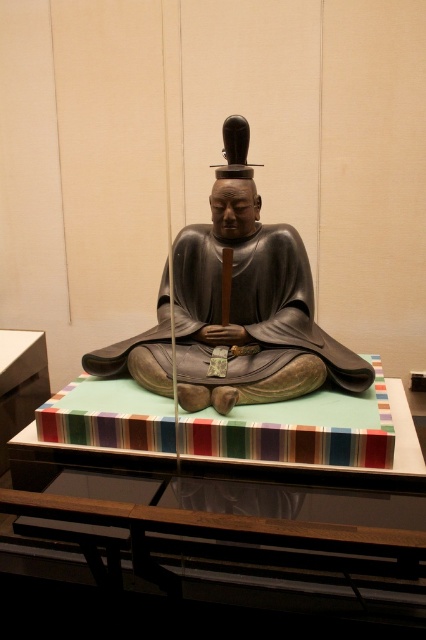
Question: Observing the image, what is the correct spatial positioning of green felt table at center in reference to matte gray statue at center?

Choices:
 (A) left
 (B) right

Answer: (B)

Question: Which object appears closest to the camera in this image?

Choices:
 (A) green felt table at center
 (B) matte gray statue at center

Answer: (A)

Question: Is green felt table at center above matte gray statue at center?

Choices:
 (A) no
 (B) yes

Answer: (A)

Question: Does green felt table at center have a smaller size compared to matte gray statue at center?

Choices:
 (A) yes
 (B) no

Answer: (A)